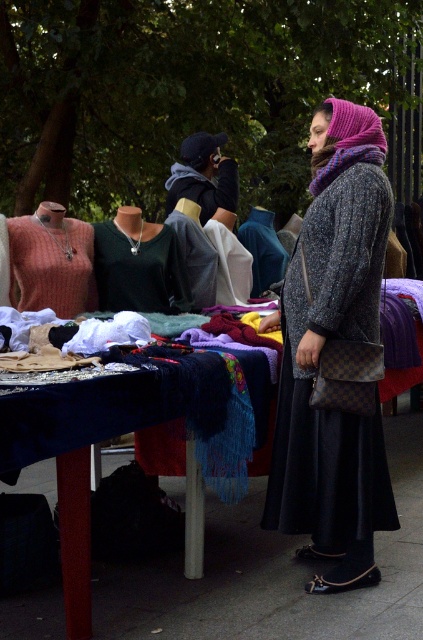
You are standing at the entrance of the outdoor market and want to walk towards the table with the dark blue cloth. Based on the smooth concrete pavement at lower center, can you determine if you need to step over or around it to reach the table?

The smooth concrete pavement at lower center is located at point (x=271, y=573), so you need to step over it to reach the table.

You are a customer at the market and want to buy a thinner garment. Which one between the knitted coral sweater at left and the matte black top at center would you choose?

The knitted coral sweater at left is thinner than the matte black top at center, so you should choose the knitted coral sweater at left.

You are a customer at the market who wants to try on the knitted coral sweater at left and the matte black top at center. Can you reach both items without moving from your current position? The distance between you and the table is 1.5 meters.

The knitted coral sweater at left and matte black top at center are 27.27 centimeters apart from each other. Since the distance between you and the table is 1.5 meters, you can comfortably reach both items without needing to move closer or further away.